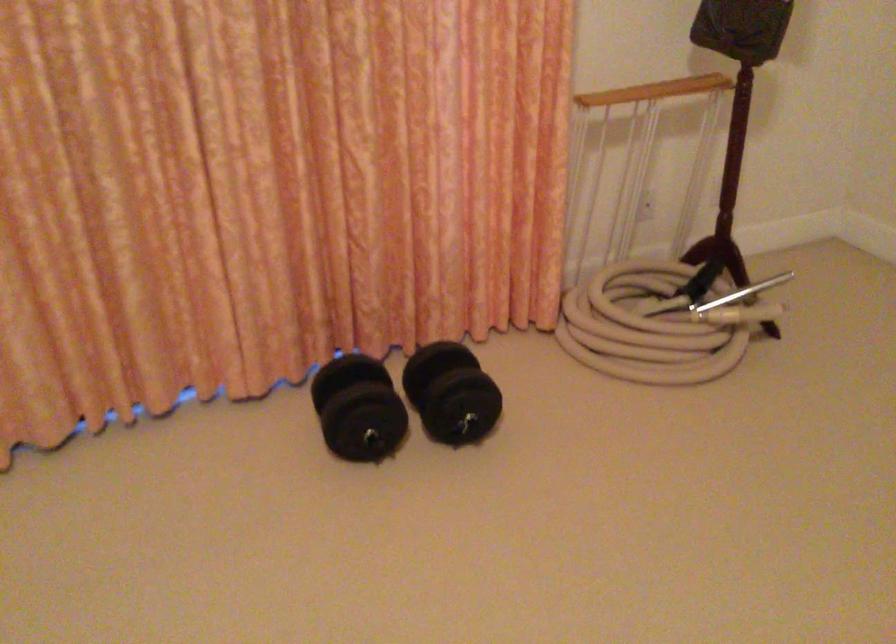
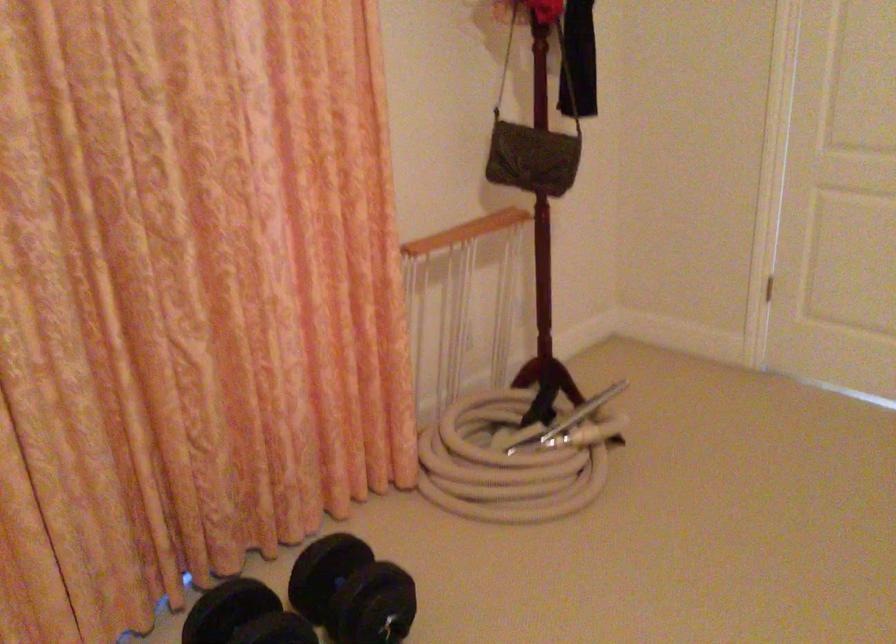
The point at (438,384) is marked in the first image. Where is the corresponding point in the second image?

(351, 591)